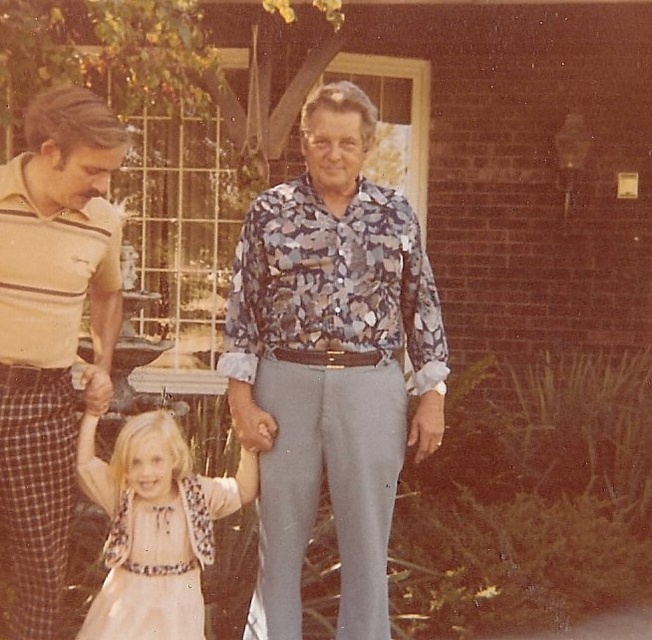
You are a fashion designer observing the scene. You need to determine which clothing item, the striped cotton shirt at left or the pastel pink satin dress at center, requires more fabric to make. Based on the information provided, which one would need more fabric?

The striped cotton shirt at left has a larger size compared to the pastel pink satin dress at center, so the striped cotton shirt at left would require more fabric to make.